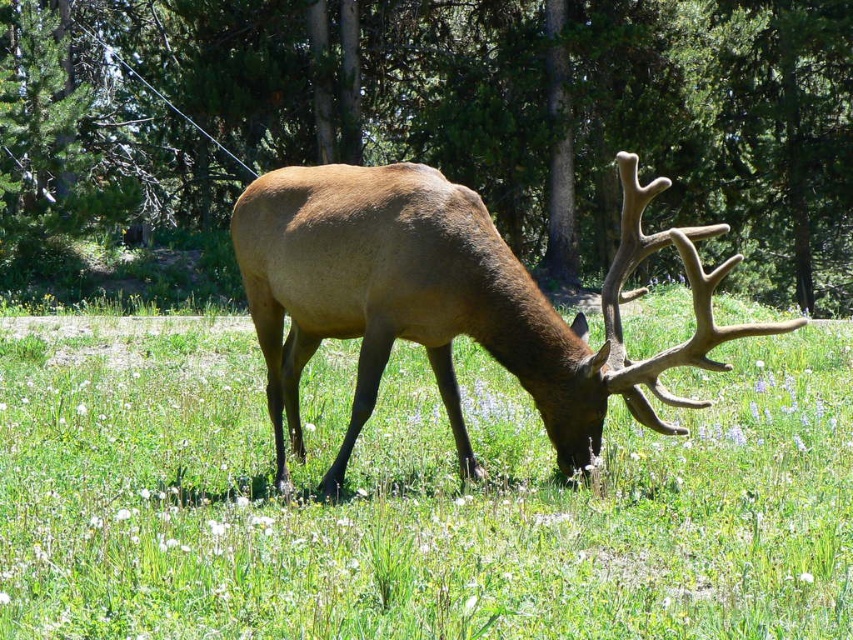
You are a photographer planning to take a photo of the green grass at center and the brown matte tree at center. Which object should you focus on first if you want to capture both clearly in sharp focus?

The green grass at center is below the brown matte tree at center, so you should focus on the brown matte tree at center first to ensure both are in sharp focus.

Consider the image. You are a wildlife photographer aiming to capture the brown velvet deer at center while ensuring the green grass at center is visible in the foreground. Can you fit both subjects in your camera frame if the maximum width your camera can capture is 1 meter?

The green grass at center is thinner than the brown velvet deer at center, so the total width required to include both subjects would be less than the deer alone. Since the camera can capture up to 1 meter, it is possible to fit both as long as the combined width of the deer and grass does not exceed the limit. However, without exact measurements, we can infer that since the grass is thinner, it might fit within the 1 meter frame.